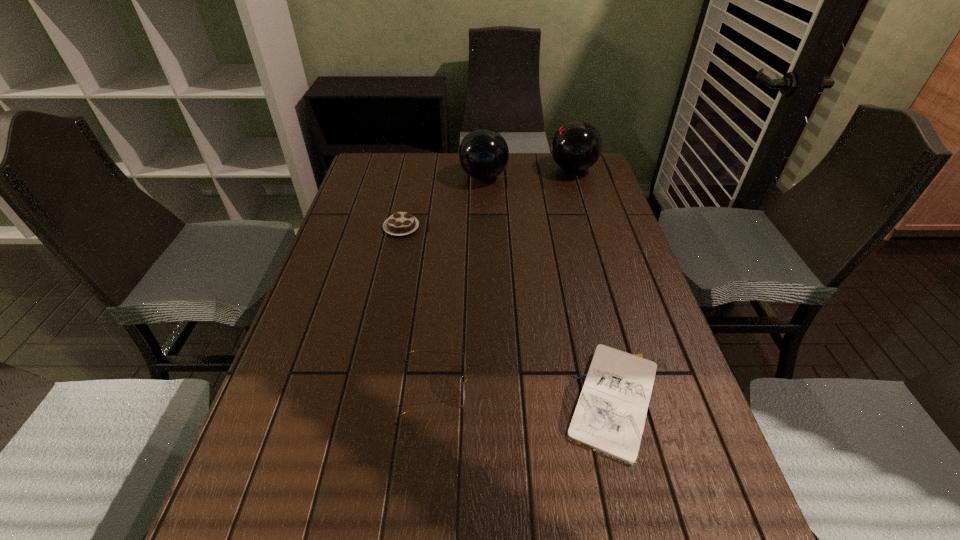
Locate an element on the screen. This screenshot has width=960, height=540. free space located 0.160m on the side of the left bowling ball with the finger holes is located at coordinates (415, 177).

Image resolution: width=960 pixels, height=540 pixels. I want to click on vacant position located on the side of the left bowling ball with the finger holes, so click(x=387, y=177).

Locate an element on the screen. The image size is (960, 540). free spot located 0.120m on the temples of the third shortest object is located at coordinates (524, 388).

Identify the location of vacant position located 0.180m on the front of the leftmost object. (390, 280).

At what (x,y) coordinates should I click in order to perform the action: click on free space located 0.390m on the left of the notebook. Please return your answer as a coordinate pair (x, y). The image size is (960, 540). Looking at the image, I should click on (373, 402).

Where is `object at the left edge`? object at the left edge is located at coordinates (400, 223).

Locate an element on the screen. The width and height of the screenshot is (960, 540). bowling ball situated at the right edge is located at coordinates (576, 146).

In order to click on notebook at the right edge in this screenshot , I will do `click(609, 417)`.

The image size is (960, 540). In order to click on object that is at the far right corner in this screenshot , I will do `click(576, 146)`.

Find the location of a particular element. Image resolution: width=960 pixels, height=540 pixels. free point at the far edge is located at coordinates (503, 180).